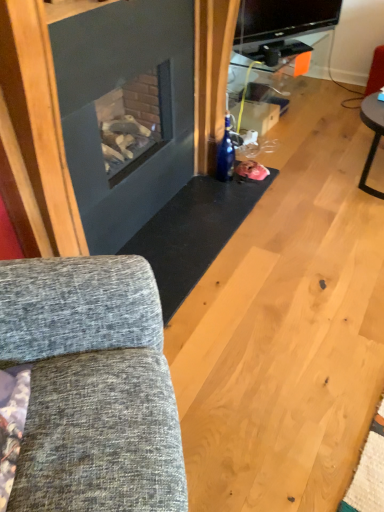
Question: From a real-world perspective, is textured gray fabric couch at left located higher than metallic silver tv stand at upper center?

Choices:
 (A) yes
 (B) no

Answer: (A)

Question: Is textured gray fabric couch at left completely or partially outside of metallic silver tv stand at upper center?

Choices:
 (A) yes
 (B) no

Answer: (A)

Question: Is textured gray fabric couch at left thinner than metallic silver tv stand at upper center?

Choices:
 (A) yes
 (B) no

Answer: (B)

Question: Does textured gray fabric couch at left lie in front of metallic silver tv stand at upper center?

Choices:
 (A) no
 (B) yes

Answer: (B)

Question: Can you confirm if textured gray fabric couch at left is shorter than metallic silver tv stand at upper center?

Choices:
 (A) no
 (B) yes

Answer: (A)

Question: Is textured gray fabric couch at left bigger than metallic silver tv stand at upper center?

Choices:
 (A) yes
 (B) no

Answer: (A)

Question: Could you tell me if metallic silver tv stand at upper center is facing textured gray fabric couch at left?

Choices:
 (A) yes
 (B) no

Answer: (B)

Question: Is textured gray fabric couch at left completely or partially inside metallic silver tv stand at upper center?

Choices:
 (A) yes
 (B) no

Answer: (B)

Question: Considering the relative sizes of metallic silver tv stand at upper center and textured gray fabric couch at left in the image provided, is metallic silver tv stand at upper center bigger than textured gray fabric couch at left?

Choices:
 (A) no
 (B) yes

Answer: (A)

Question: Can you confirm if metallic silver tv stand at upper center is shorter than textured gray fabric couch at left?

Choices:
 (A) yes
 (B) no

Answer: (A)

Question: Considering the relative sizes of metallic silver tv stand at upper center and textured gray fabric couch at left in the image provided, is metallic silver tv stand at upper center smaller than textured gray fabric couch at left?

Choices:
 (A) yes
 (B) no

Answer: (A)

Question: Is metallic silver tv stand at upper center wider than textured gray fabric couch at left?

Choices:
 (A) yes
 (B) no

Answer: (B)

Question: Considering the positions of textured gray fabric couch at left and metallic silver tv stand at upper center in the image, is textured gray fabric couch at left bigger or smaller than metallic silver tv stand at upper center?

Choices:
 (A) small
 (B) big

Answer: (B)